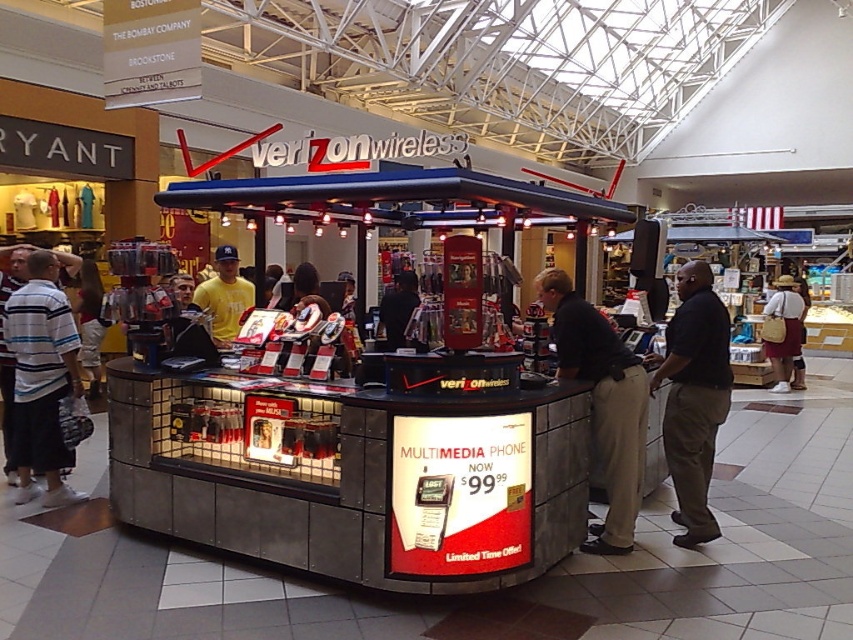
Does point (592, 410) come in front of point (25, 397)?

Yes, it is.

What do you see at coordinates (602, 403) in the screenshot? I see `dark brown pants at center` at bounding box center [602, 403].

The image size is (853, 640). What do you see at coordinates (602, 403) in the screenshot?
I see `dark brown pants at center` at bounding box center [602, 403].

The width and height of the screenshot is (853, 640). I want to click on dark brown pants at center, so click(602, 403).

Can you confirm if dark brown pants at center is shorter than black smooth shirt at right?

Indeed, dark brown pants at center has a lesser height compared to black smooth shirt at right.

Does dark brown pants at center appear on the right side of black smooth shirt at right?

No, dark brown pants at center is not to the right of black smooth shirt at right.

Is point (543, 301) positioned before point (704, 364)?

That is False.

The height and width of the screenshot is (640, 853). I want to click on dark brown pants at center, so click(602, 403).

Who is shorter, dark brown pants at center or black fabric shirt at center?

With less height is black fabric shirt at center.

Is point (637, 406) farther from camera compared to point (401, 305)?

No, it is not.

Identify the location of dark brown pants at center. (602, 403).